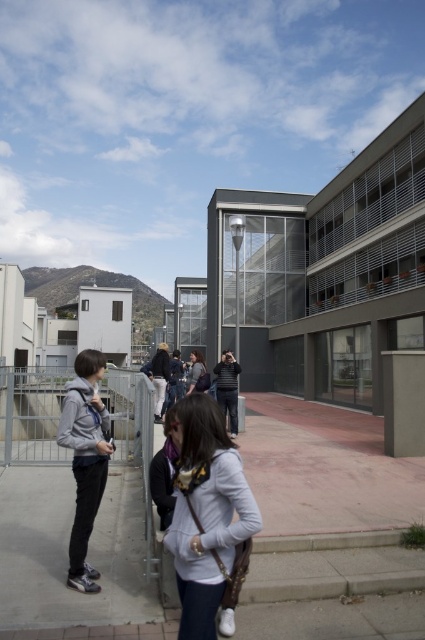
Question: Which point appears farthest from the camera in this image?

Choices:
 (A) (220, 384)
 (B) (88, 458)
 (C) (218, 465)

Answer: (A)

Question: Is light gray fabric backpack at center below gray hoodie at left?

Choices:
 (A) no
 (B) yes

Answer: (A)

Question: Among these objects, which one is nearest to the camera?

Choices:
 (A) gray hoodie at left
 (B) light gray fabric backpack at center
 (C) striped sweater at center

Answer: (B)

Question: Is gray hoodie at left bigger than striped sweater at center?

Choices:
 (A) yes
 (B) no

Answer: (A)

Question: Which of these objects is positioned closest to the light gray fabric backpack at center?

Choices:
 (A) gray hoodie at left
 (B) striped sweater at center

Answer: (A)

Question: Does light gray fabric backpack at center appear on the left side of gray hoodie at left?

Choices:
 (A) yes
 (B) no

Answer: (B)